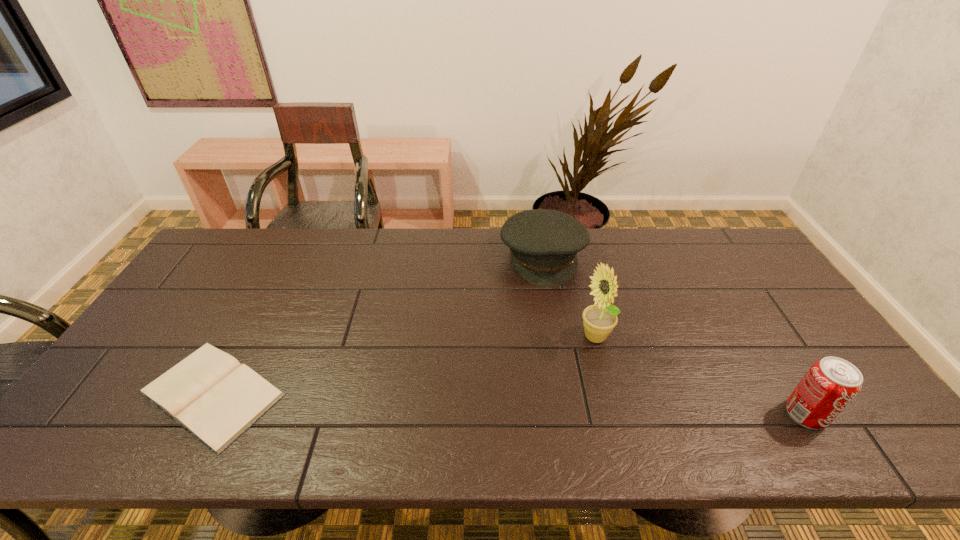
This screenshot has height=540, width=960. In order to click on free spot that satisfies the following two spatial constraints: 1. on the back side of the farthest object; 2. on the left side of the shortest object in this screenshot , I will do `click(285, 257)`.